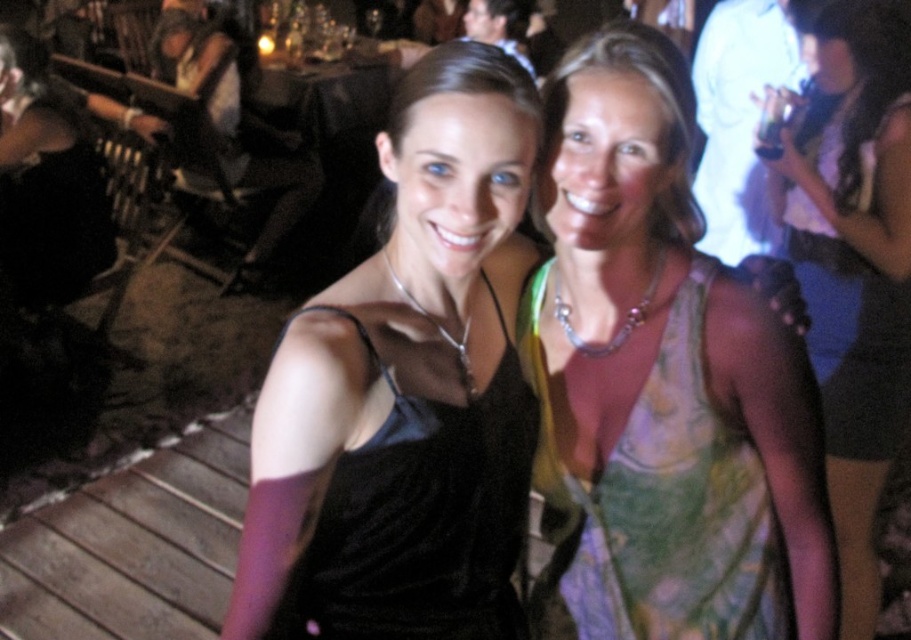
Between green floral dress at center and green floral dress at upper right, which one is positioned higher?

Positioned higher is green floral dress at upper right.

Does point (879, 413) come in front of point (860, 337)?

Yes, point (879, 413) is in front of point (860, 337).

This screenshot has width=911, height=640. Identify the location of green floral dress at center. (855, 266).

Consider the image. Does printed silk dress at center have a greater height compared to green floral dress at upper right?

No, printed silk dress at center is not taller than green floral dress at upper right.

Can you confirm if printed silk dress at center is positioned to the right of green floral dress at upper right?

In fact, printed silk dress at center is to the left of green floral dress at upper right.

Is point (674, 589) farther from viewer compared to point (865, 348)?

No, (674, 589) is in front of (865, 348).

The width and height of the screenshot is (911, 640). I want to click on printed silk dress at center, so click(654, 506).

Consider the image. Does printed silk dress at center appear on the left side of black satin dress at center?

Incorrect, printed silk dress at center is not on the left side of black satin dress at center.

Who is more forward, (630, 538) or (494, 440)?

Point (494, 440) is in front.

Does point (761, 513) lie in front of point (431, 444)?

That is False.

At what (x,y) coordinates should I click in order to perform the action: click on printed silk dress at center. Please return your answer as a coordinate pair (x, y). Looking at the image, I should click on (654, 506).